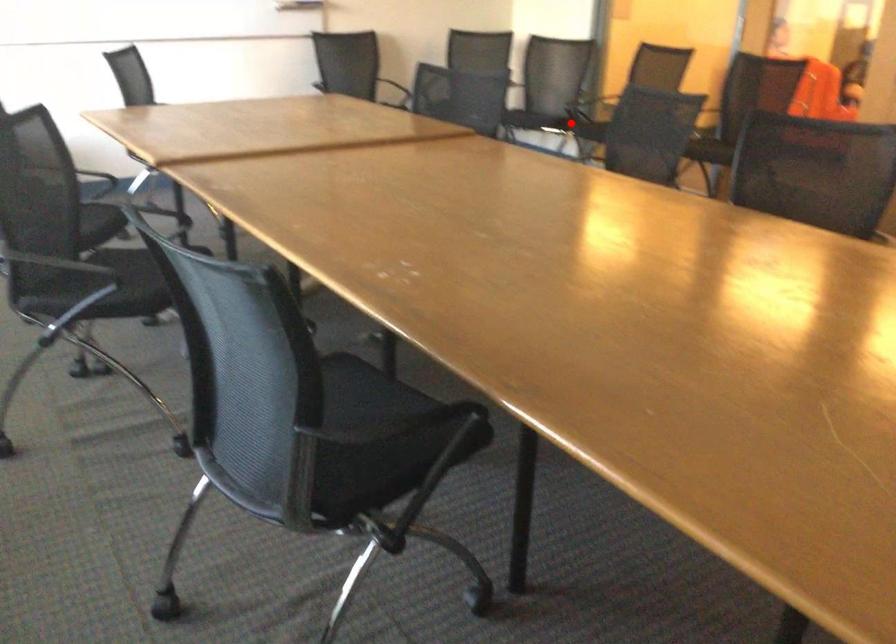
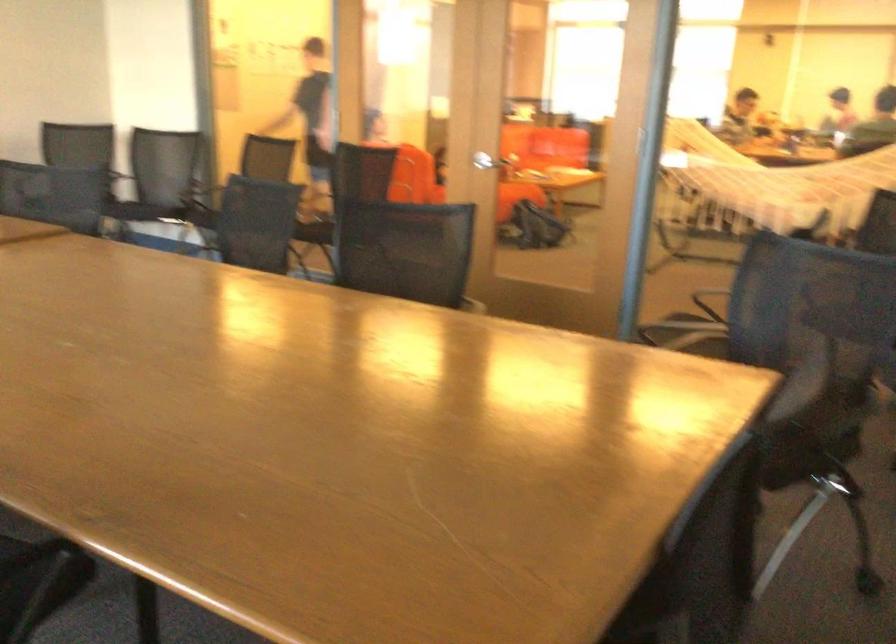
The point at the highlighted location is marked in the first image. Where is the corresponding point in the second image?

(202, 216)